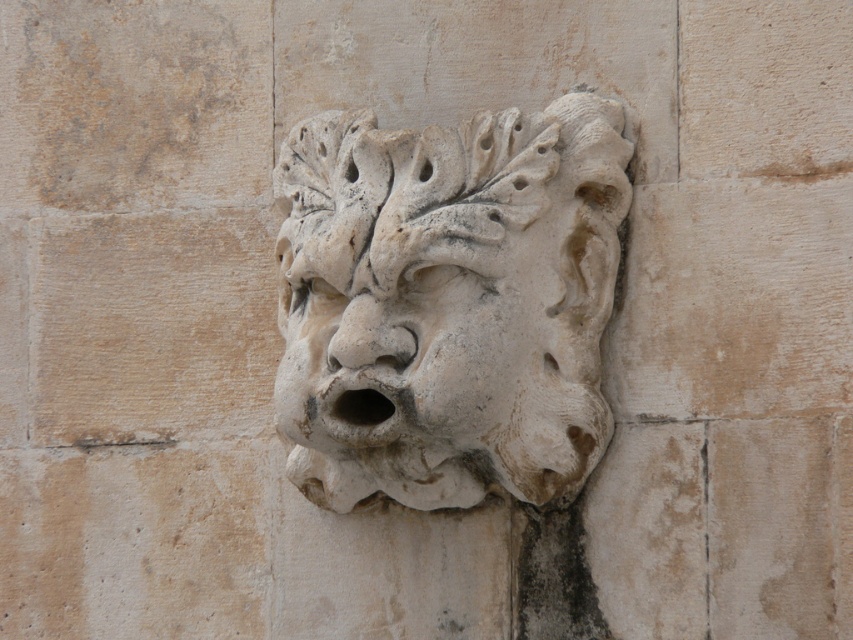
Question: Where is white stone lion at center located in relation to white stone face at center in the image?

Choices:
 (A) right
 (B) left

Answer: (A)

Question: Is white stone lion at center further to camera compared to white stone face at center?

Choices:
 (A) no
 (B) yes

Answer: (B)

Question: Can you confirm if white stone lion at center is thinner than white stone face at center?

Choices:
 (A) no
 (B) yes

Answer: (A)